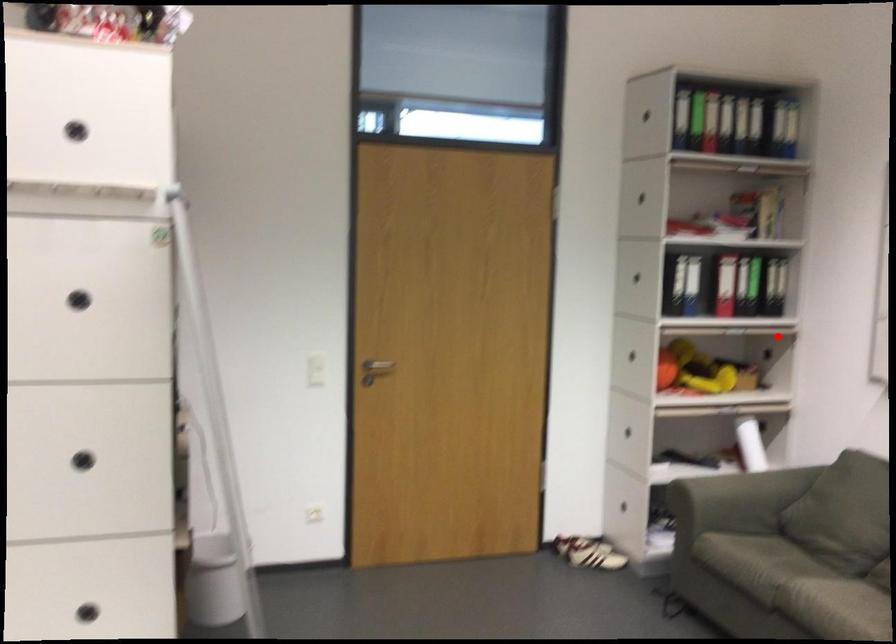
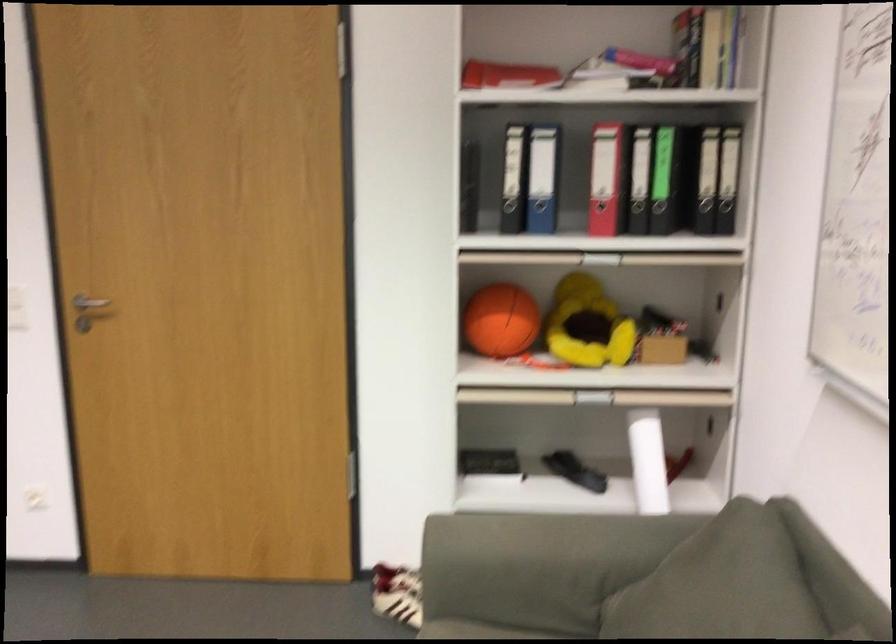
Question: I am providing you with two images of the same scene from different viewpoints. Given a red point in image1, look at the same physical point in image2. Is it:

Choices:
 (A) Closer to the viewpoint
 (B) Farther from the viewpoint

Answer: (A)